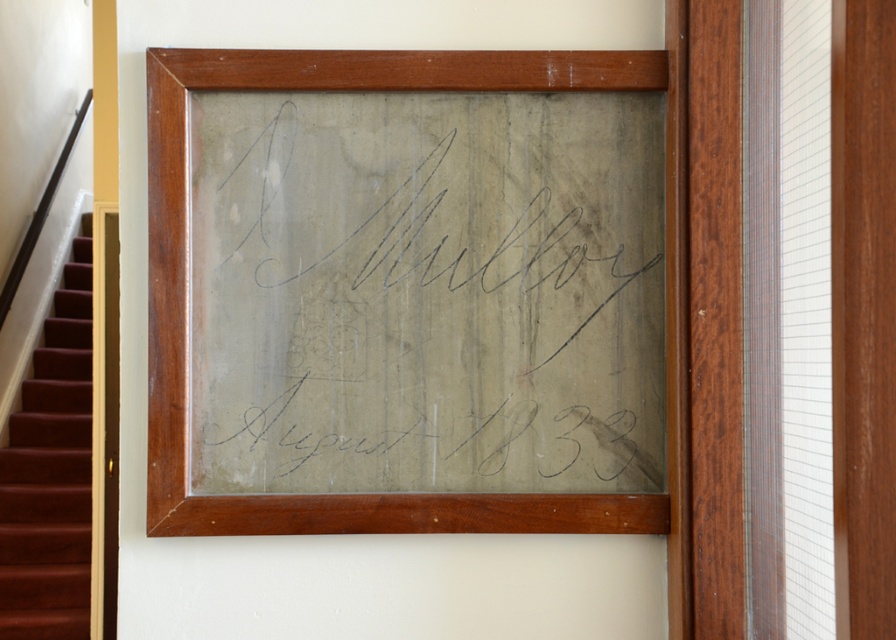
Consider the image. Who is lower down, matte gray paper at center or maroon carpeted stairs at left?

maroon carpeted stairs at left is below.

Who is taller, matte gray paper at center or maroon carpeted stairs at left?

With more height is maroon carpeted stairs at left.

Is point (269, 451) positioned behind point (11, 632)?

No, it is in front of (11, 632).

Locate an element on the screen. matte gray paper at center is located at coordinates (427, 292).